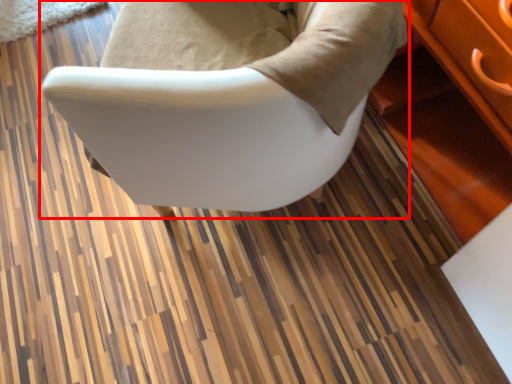
Question: From the image's perspective, considering the relative positions of chair (annotated by the red box) and table in the image provided, where is chair (annotated by the red box) located with respect to the staircase?

Choices:
 (A) below
 (B) above

Answer: (B)